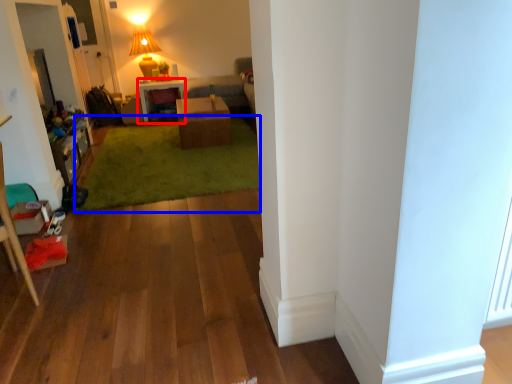
Question: Which object appears farthest to the camera in this image, desk (highlighted by a red box) or grass (highlighted by a blue box)?

Choices:
 (A) desk
 (B) grass

Answer: (A)